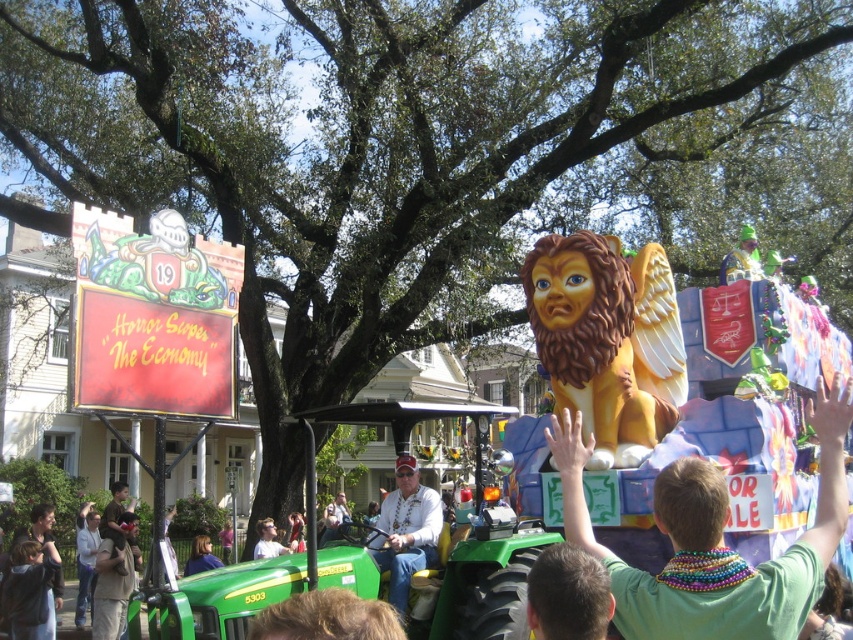
You are a photographer standing in the middle of the parade route. You want to take a photo of both the green jersey at center and the golden matte lion at center. Which object should you focus on first to ensure both are in the frame?

You should focus on the green jersey at center first since it is closer to the viewer than the golden matte lion at center, allowing you to adjust the frame to include both.

You are standing at the starting point of the parade route and see the point marked at coordinates point (569,470). If you need to place a banner 30 meters away from the starting point, will the banner be placed beyond that point?

The distance of point (569,470) from viewer is 34.56 meters, so placing a banner 30 meters away would be before reaching that point, meaning the banner would be placed before the point (569,470).